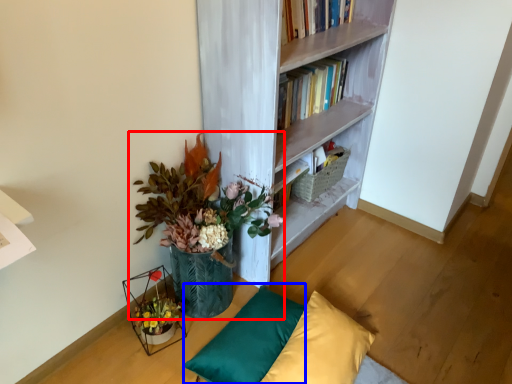
Question: Which of the following is the closest to the observer, houseplant (highlighted by a red box) or pillow (highlighted by a blue box)?

Choices:
 (A) houseplant
 (B) pillow

Answer: (A)